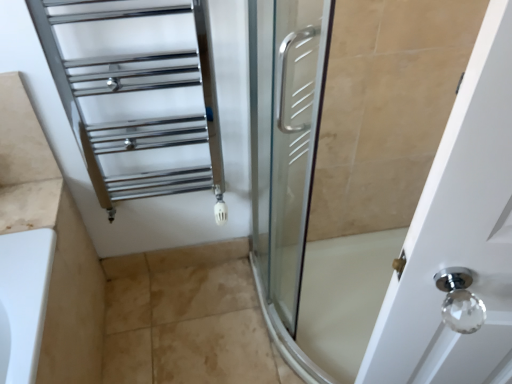
Question: From the image's perspective, is chrome/metallic towel rack at upper left above or below beige tile at lower center?

Choices:
 (A) below
 (B) above

Answer: (B)

Question: From a real-world perspective, is chrome/metallic towel rack at upper left above or below beige tile at lower center?

Choices:
 (A) above
 (B) below

Answer: (A)

Question: Considering the relative positions of chrome/metallic towel rack at upper left and beige tile at lower center in the image provided, is chrome/metallic towel rack at upper left to the left or to the right of beige tile at lower center?

Choices:
 (A) left
 (B) right

Answer: (A)

Question: Would you say beige tile at lower center is to the left or to the right of chrome/metallic towel rack at upper left in the picture?

Choices:
 (A) right
 (B) left

Answer: (A)

Question: Does point (198, 243) appear closer or farther from the camera than point (215, 170)?

Choices:
 (A) farther
 (B) closer

Answer: (A)

Question: Considering the positions of beige tile at lower center and chrome/metallic towel rack at upper left in the image, is beige tile at lower center taller or shorter than chrome/metallic towel rack at upper left?

Choices:
 (A) tall
 (B) short

Answer: (B)

Question: Is beige tile at lower center bigger or smaller than chrome/metallic towel rack at upper left?

Choices:
 (A) small
 (B) big

Answer: (A)